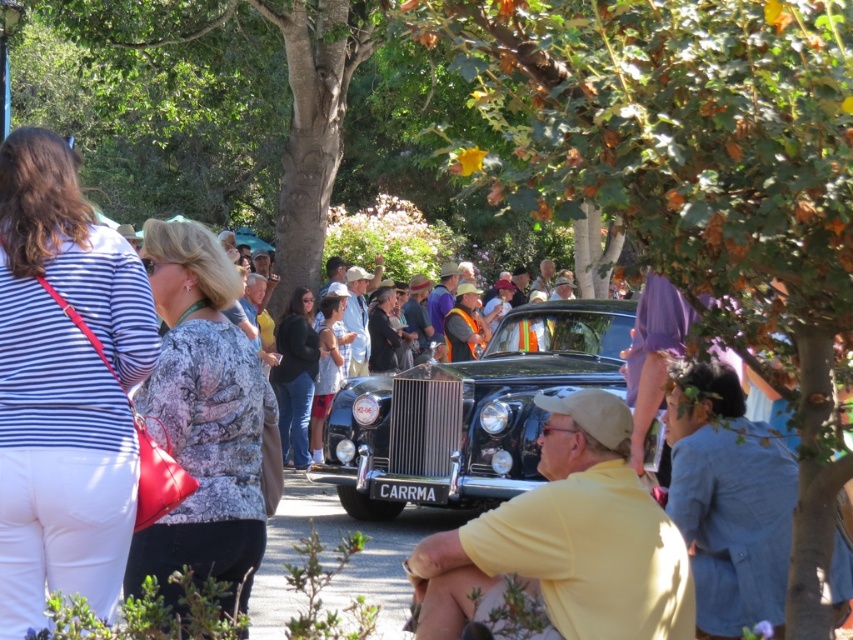
Question: Estimate the real-world distances between objects in this image. Which object is closer to the green leafy tree at upper center?

Choices:
 (A) yellow cotton shirt at center
 (B) striped fabric shirt at left
 (C) printed fabric blouse at center

Answer: (A)

Question: Estimate the real-world distances between objects in this image. Which object is farther from the printed fabric blouse at center?

Choices:
 (A) shiny black car at center
 (B) striped fabric shirt at left

Answer: (A)

Question: Is the position of green leafy tree at upper center less distant than that of printed fabric blouse at center?

Choices:
 (A) no
 (B) yes

Answer: (B)

Question: Can you confirm if yellow cotton shirt at center is positioned above shiny black car at center?

Choices:
 (A) yes
 (B) no

Answer: (B)

Question: Observing the image, what is the correct spatial positioning of green leafy tree at upper center in reference to printed fabric blouse at center?

Choices:
 (A) below
 (B) above

Answer: (B)

Question: Which object is the closest to the shiny black car at center?

Choices:
 (A) printed fabric blouse at center
 (B) green leafy tree at upper center
 (C) striped fabric shirt at left
 (D) yellow cotton shirt at center

Answer: (D)